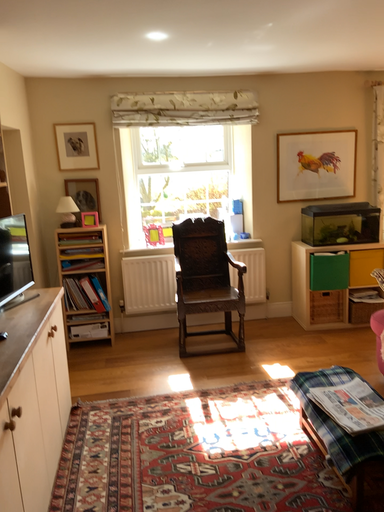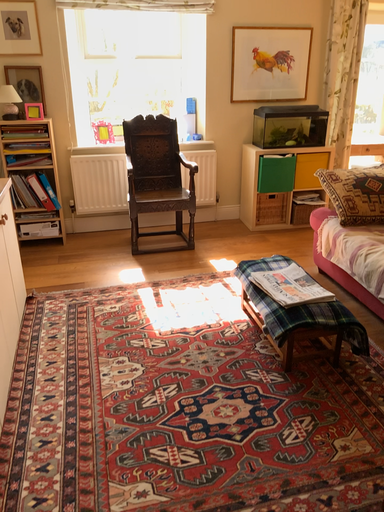
Question: Which way did the camera rotate in the video?

Choices:
 (A) rotated right
 (B) rotated left

Answer: (A)